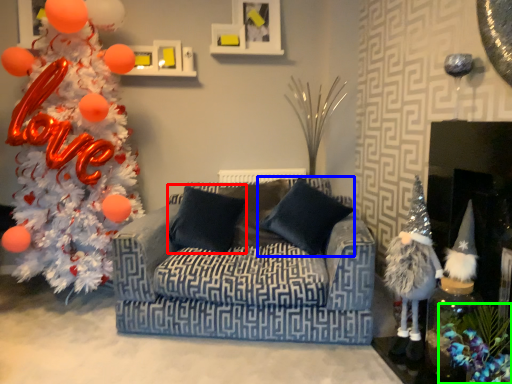
Question: Which object is positioned closest to pillow (highlighted by a red box)? Select from pillow (highlighted by a blue box) and christmas decoration (highlighted by a green box).

Choices:
 (A) pillow
 (B) christmas decoration

Answer: (A)